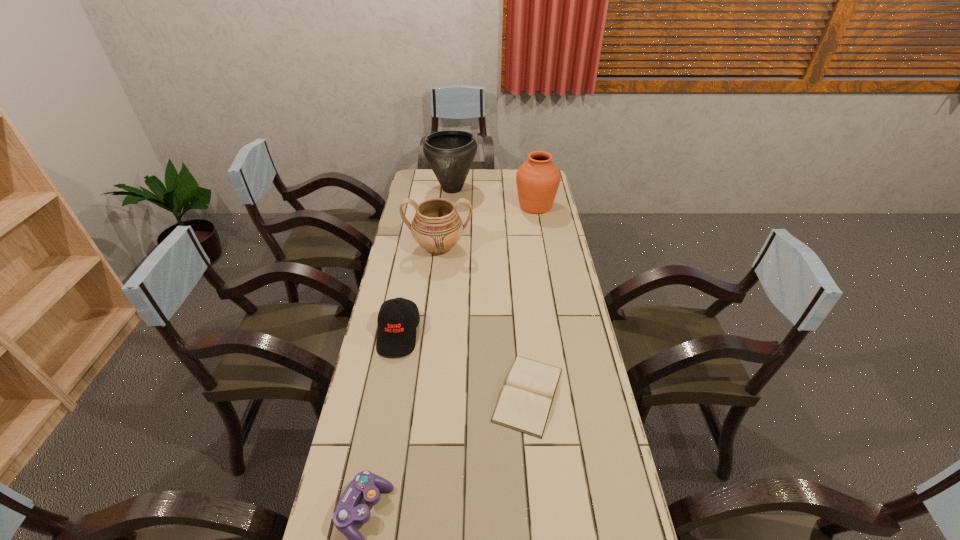
In order to click on free space between the rightmost urn and the shortest object in this screenshot , I will do `click(532, 300)`.

This screenshot has width=960, height=540. In order to click on the second closest object to the third farthest object in this screenshot , I will do `click(450, 153)`.

At what (x,y) coordinates should I click in order to perform the action: click on object that stands as the third closest to the Bible. Please return your answer as a coordinate pair (x, y). This screenshot has width=960, height=540. Looking at the image, I should click on (437, 227).

Locate an element on the screen. urn object that ranks as the second closest to the rightmost urn is located at coordinates [437, 227].

Identify which urn is located as the third nearest to the third shortest object. Please provide its 2D coordinates. Your answer should be formatted as a tuple, i.e. [(x, y)], where the tuple contains the x and y coordinates of a point satisfying the conditions above.

[(450, 153)]

Locate an element on the screen. free spot that satisfies the following two spatial constraints: 1. on the front-facing side of the fourth tallest object; 2. on the left side of the shortest object is located at coordinates (388, 394).

Find the location of a particular element. The width and height of the screenshot is (960, 540). vacant space that satisfies the following two spatial constraints: 1. on the front-facing side of the Bible; 2. on the left side of the nearest urn is located at coordinates (421, 394).

Identify the location of free space that satisfies the following two spatial constraints: 1. on the front-facing side of the third shortest object; 2. on the left side of the shortest object. This screenshot has height=540, width=960. (388, 394).